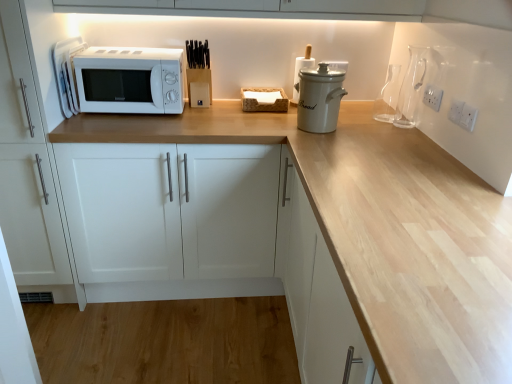
Question: Does white ceramic crock at center, the third appliance in the left-to-right sequence, have a greater width compared to transparent glass carafe at upper right?

Choices:
 (A) yes
 (B) no

Answer: (A)

Question: Is transparent glass carafe at upper right at the back of white ceramic crock at center, the third appliance in the left-to-right sequence?

Choices:
 (A) yes
 (B) no

Answer: (B)

Question: From a real-world perspective, is white ceramic crock at center, acting as the second appliance starting from the right, below transparent glass carafe at upper right?

Choices:
 (A) no
 (B) yes

Answer: (A)

Question: Is white ceramic crock at center, acting as the second appliance starting from the right, bigger than transparent glass carafe at upper right?

Choices:
 (A) yes
 (B) no

Answer: (A)

Question: Can we say white ceramic crock at center, the third appliance in the left-to-right sequence, lies outside transparent glass carafe at upper right?

Choices:
 (A) yes
 (B) no

Answer: (A)

Question: From the image's perspective, relative to white matte microwave at upper left, marked as the 1th appliance in a left-to-right arrangement, is white matte cabinet at left, marked as the first cabinetry in a left-to-right arrangement, above or below?

Choices:
 (A) below
 (B) above

Answer: (A)

Question: Considering their positions, is white matte cabinet at left, the 2th cabinetry from the right, located in front of or behind white matte microwave at upper left, marked as the 1th appliance in a left-to-right arrangement?

Choices:
 (A) front
 (B) behind

Answer: (A)

Question: Considering the positions of white matte cabinet at left, the 2th cabinetry from the right, and white matte microwave at upper left, which is the fourth appliance from right to left, in the image, is white matte cabinet at left, the 2th cabinetry from the right, taller or shorter than white matte microwave at upper left, which is the fourth appliance from right to left,?

Choices:
 (A) tall
 (B) short

Answer: (A)

Question: Is white matte cabinet at left, the 2th cabinetry from the right, bigger or smaller than white matte microwave at upper left, which is the fourth appliance from right to left?

Choices:
 (A) small
 (B) big

Answer: (B)

Question: From the image's perspective, is white matte microwave at left positioned above or below white ceramic crock at center, which appears as the second appliance when viewed from the left?

Choices:
 (A) below
 (B) above

Answer: (A)

Question: Is point (146, 84) closer or farther from the camera than point (300, 61)?

Choices:
 (A) farther
 (B) closer

Answer: (A)

Question: Considering their positions, is white matte microwave at left located in front of or behind white ceramic crock at center, which appears as the second appliance when viewed from the left?

Choices:
 (A) front
 (B) behind

Answer: (A)

Question: From a real-world perspective, is white matte microwave at left positioned above or below white ceramic crock at center, which appears as the second appliance when viewed from the left?

Choices:
 (A) below
 (B) above

Answer: (A)

Question: Based on their positions, is white plastic electric outlet at upper right, which appears as the 2th electric outlet when ordered from the bottom, located to the left or right of transparent glass carafe at upper right?

Choices:
 (A) right
 (B) left

Answer: (A)

Question: Looking at the image, does white plastic electric outlet at upper right, which is the first electric outlet in top-to-bottom order, seem bigger or smaller compared to transparent glass carafe at upper right?

Choices:
 (A) small
 (B) big

Answer: (A)